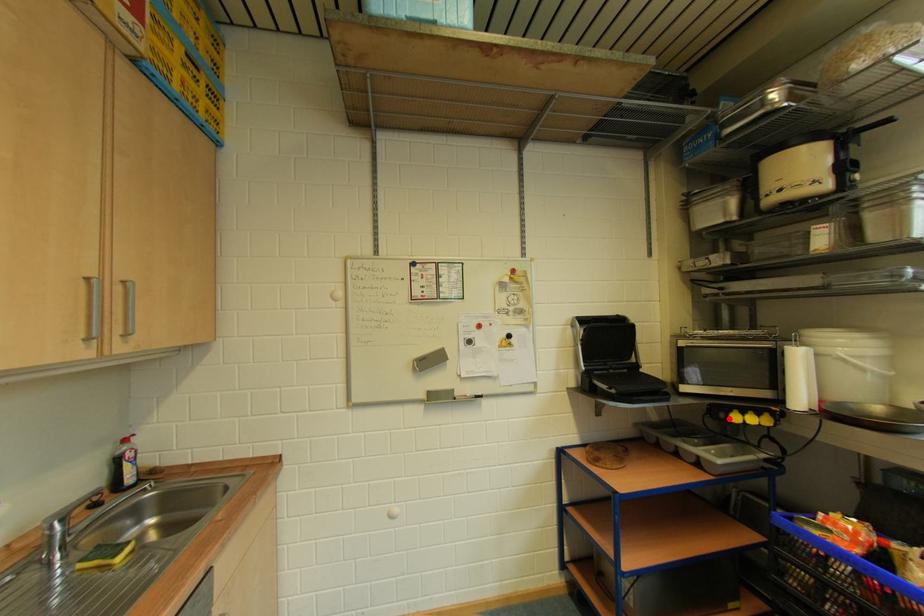
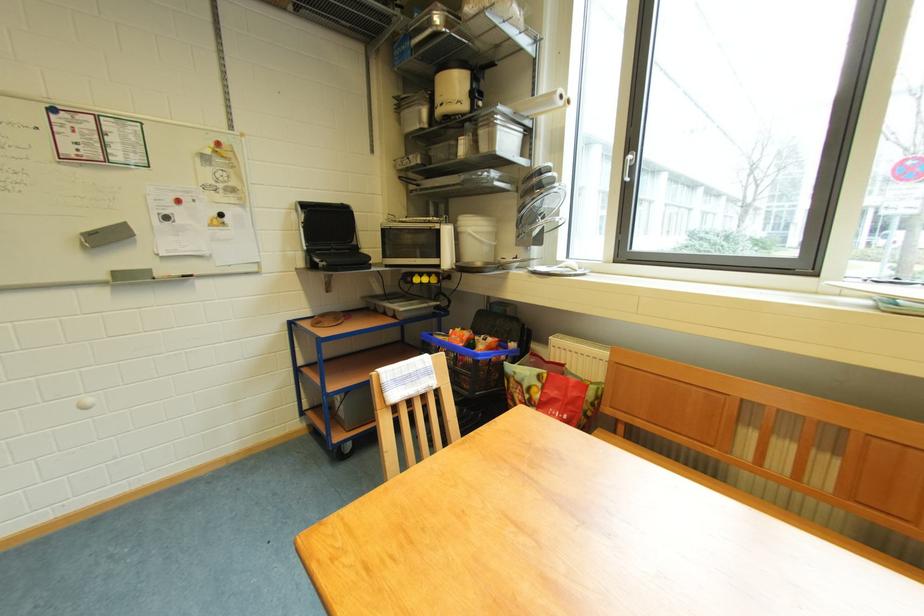
The point at the highlighted location is marked in the first image. Where is the corresponding point in the second image?

(417, 282)